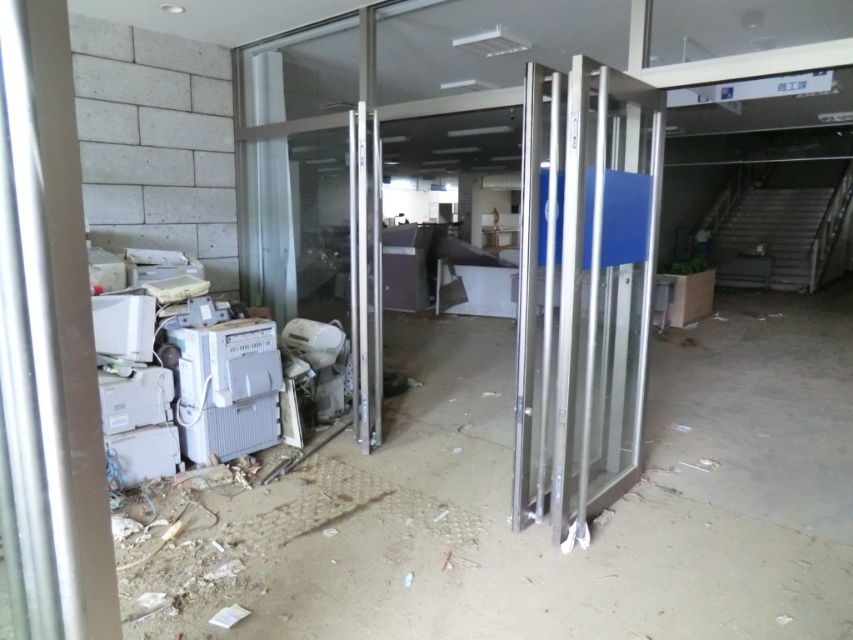
In the scene shown: You are navigating through an abandoned building and need to reach a specific location. You see two points marked as point (395, 616) and point (613, 497). Which point is closer to you from your current position?

Point (395, 616) is in front of point (613, 497), so it is closer to you.

Consider the image. You are a maintenance worker entering through the partially open metal security gate. You need to reach the polished silver glass door at center to secure it. However, there are metallic gray electronics at lower left blocking your path. Can you navigate around them to reach the door?

The polished silver glass door at center is behind metallic gray electronics at lower left, so you can navigate around the metallic gray electronics at lower left to reach the door.